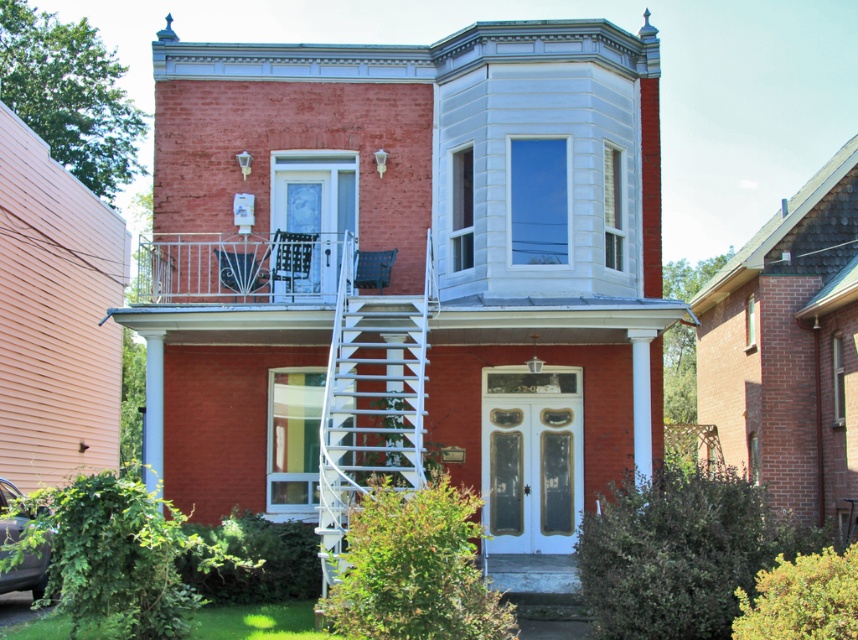
Is white metal balcony at upper center thinner than shiny black car at lower left?

In fact, white metal balcony at upper center might be wider than shiny black car at lower left.

Can you confirm if white metal balcony at upper center is positioned to the right of shiny black car at lower left?

In fact, white metal balcony at upper center is to the left of shiny black car at lower left.

Where is `white metal balcony at upper center`? This screenshot has height=640, width=858. white metal balcony at upper center is located at coordinates (239, 266).

Between white metal staircase at center and shiny black car at lower left, which one appears on the left side from the viewer's perspective?

shiny black car at lower left is more to the left.

Can you confirm if white metal staircase at center is bigger than shiny black car at lower left?

Indeed, white metal staircase at center has a larger size compared to shiny black car at lower left.

Who is more forward, (372, 456) or (11, 529)?

Point (11, 529) is in front.

In order to click on white metal staircase at center in this screenshot , I will do `click(370, 400)`.

Where is `white metal staircase at center`? white metal staircase at center is located at coordinates (370, 400).

Does white metal staircase at center have a larger size compared to white metal balcony at upper center?

Incorrect, white metal staircase at center is not larger than white metal balcony at upper center.

Between point (373, 394) and point (276, 296), which one is positioned in front?

Point (373, 394)

Locate an element on the screen. The width and height of the screenshot is (858, 640). white metal staircase at center is located at coordinates (370, 400).